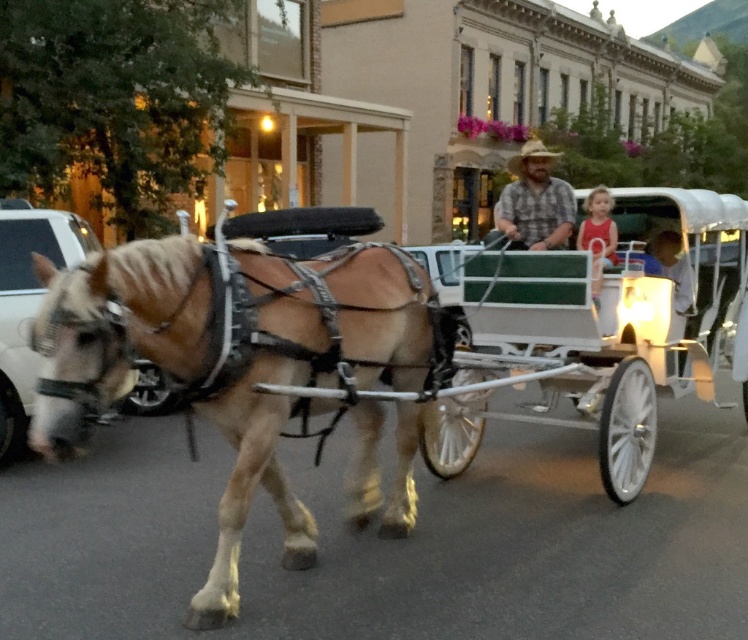
Question: Which object appears farthest from the camera in this image?

Choices:
 (A) matte red shirt at center
 (B) light blue shirt at center
 (C) light brown leather horse at left
 (D) plaid shirt at center

Answer: (B)

Question: Which object is farther from the camera taking this photo?

Choices:
 (A) matte red shirt at center
 (B) plaid shirt at center
 (C) metallic silver car at left
 (D) light blue shirt at center

Answer: (D)

Question: Which of the following is the farthest from the observer?

Choices:
 (A) (239, 435)
 (B) (1, 262)
 (C) (533, 152)

Answer: (C)

Question: Considering the relative positions of plaid shirt at center and light blue shirt at center in the image provided, where is plaid shirt at center located with respect to light blue shirt at center?

Choices:
 (A) right
 (B) left

Answer: (A)

Question: In this image, where is metallic silver car at left located relative to light blue shirt at center?

Choices:
 (A) left
 (B) right

Answer: (A)

Question: Does light brown leather horse at left appear on the right side of plaid shirt at center?

Choices:
 (A) yes
 (B) no

Answer: (B)